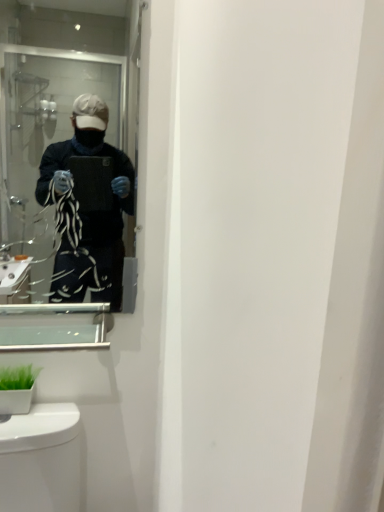
Question: Is green matte plant at lower left wider than clear glass mirror at upper left?

Choices:
 (A) yes
 (B) no

Answer: (A)

Question: Considering the relative positions of green matte plant at lower left and clear glass mirror at upper left in the image provided, is green matte plant at lower left behind clear glass mirror at upper left?

Choices:
 (A) yes
 (B) no

Answer: (A)

Question: Can we say green matte plant at lower left lies outside clear glass mirror at upper left?

Choices:
 (A) yes
 (B) no

Answer: (A)

Question: Does green matte plant at lower left have a lesser height compared to clear glass mirror at upper left?

Choices:
 (A) yes
 (B) no

Answer: (A)

Question: Is green matte plant at lower left smaller than clear glass mirror at upper left?

Choices:
 (A) yes
 (B) no

Answer: (A)

Question: Considering the positions of point (61, 333) and point (91, 155), is point (61, 333) closer or farther from the camera than point (91, 155)?

Choices:
 (A) farther
 (B) closer

Answer: (A)

Question: From a real-world perspective, relative to clear glass mirror at upper left, is clear glass medicine cabinet at lower left vertically above or below?

Choices:
 (A) below
 (B) above

Answer: (A)

Question: In terms of size, does clear glass medicine cabinet at lower left appear bigger or smaller than clear glass mirror at upper left?

Choices:
 (A) small
 (B) big

Answer: (A)

Question: Is clear glass medicine cabinet at lower left wider or thinner than clear glass mirror at upper left?

Choices:
 (A) thin
 (B) wide

Answer: (B)

Question: From a real-world perspective, is clear glass mirror at upper left physically located above or below clear glass medicine cabinet at lower left?

Choices:
 (A) below
 (B) above

Answer: (B)

Question: Considering the positions of clear glass mirror at upper left and clear glass medicine cabinet at lower left in the image, is clear glass mirror at upper left bigger or smaller than clear glass medicine cabinet at lower left?

Choices:
 (A) small
 (B) big

Answer: (B)

Question: Does point (3, 110) appear closer or farther from the camera than point (11, 347)?

Choices:
 (A) closer
 (B) farther

Answer: (B)

Question: Considering the positions of clear glass mirror at upper left and clear glass medicine cabinet at lower left in the image, is clear glass mirror at upper left taller or shorter than clear glass medicine cabinet at lower left?

Choices:
 (A) tall
 (B) short

Answer: (A)

Question: Is green matte plant at lower left in front of or behind clear glass medicine cabinet at lower left in the image?

Choices:
 (A) behind
 (B) front

Answer: (A)

Question: Is green matte plant at lower left spatially inside clear glass medicine cabinet at lower left, or outside of it?

Choices:
 (A) outside
 (B) inside

Answer: (A)